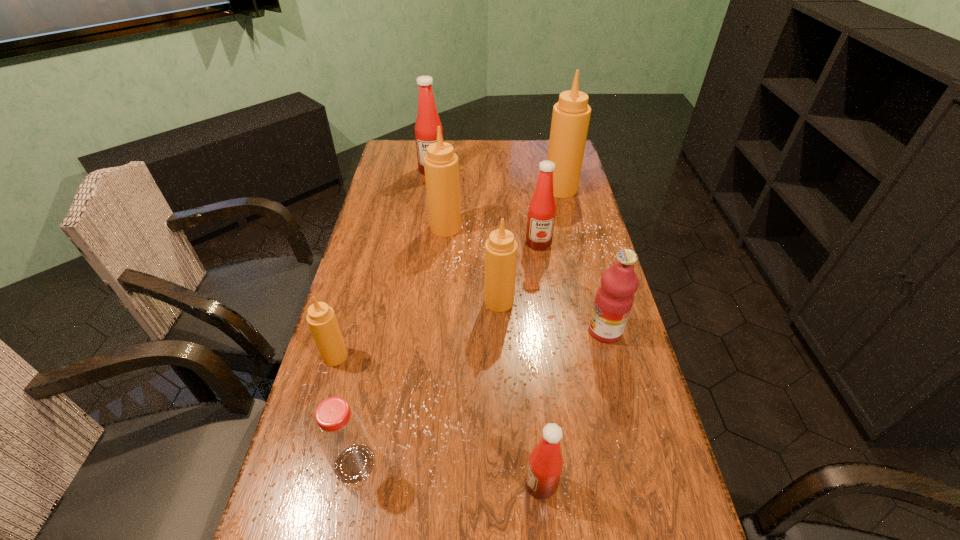
Find the location of a particular element. This screenshot has width=960, height=540. bottle that is at the left edge is located at coordinates (342, 436).

Locate an element on the screen. This screenshot has height=540, width=960. condiment present at the right edge is located at coordinates (571, 114).

Where is `fruit juice at the right edge`? fruit juice at the right edge is located at coordinates (614, 299).

The width and height of the screenshot is (960, 540). In order to click on object that is at the far left corner in this screenshot , I will do `click(427, 122)`.

In the image, there is a desktop. Where is `free space at the far edge`? The image size is (960, 540). free space at the far edge is located at coordinates (516, 149).

The image size is (960, 540). I want to click on vacant space at the left edge, so click(418, 171).

This screenshot has width=960, height=540. I want to click on vacant space at the right edge of the desktop, so click(x=613, y=428).

Identify the location of free space between the second farthest tan condiment and the biggest tan condiment. coord(503,208).

This screenshot has width=960, height=540. I want to click on vacant space in between the fruit juice and the bottle, so click(x=480, y=397).

Locate an element on the screen. free space between the nearest condiment and the bottle is located at coordinates (448, 474).